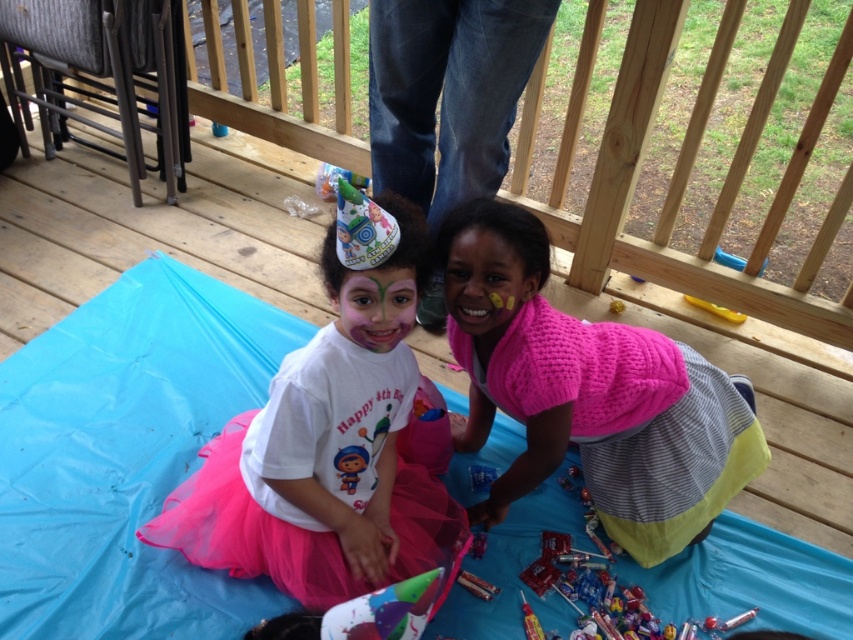
Identify the location of metallic silver toy at lower center. The image size is (853, 640). (476, 586).

Can you confirm if metallic silver toy at lower center is positioned above blue plastic toy at lower center?

No, metallic silver toy at lower center is not above blue plastic toy at lower center.

The height and width of the screenshot is (640, 853). I want to click on metallic silver toy at lower center, so click(x=476, y=586).

Where is `metallic silver toy at lower center`? metallic silver toy at lower center is located at coordinates tap(476, 586).

Does rubberized plastic toy at lower center have a larger size compared to yellow rubber ball at center?

No.

Does rubberized plastic toy at lower center appear under yellow rubber ball at center?

Yes, rubberized plastic toy at lower center is below yellow rubber ball at center.

Which is in front, point (473, 556) or point (614, 310)?

Point (473, 556)

Where is `rubberized plastic toy at lower center`? Image resolution: width=853 pixels, height=640 pixels. rubberized plastic toy at lower center is located at coordinates (479, 545).

Is white matte t-shirt at center bigger than blue plastic toy at upper right?

Indeed, white matte t-shirt at center has a larger size compared to blue plastic toy at upper right.

Which is in front, point (399, 481) or point (715, 252)?

Point (399, 481)

You are a GUI agent. You are given a task and a screenshot of the screen. Output one action in this format:
    pyautogui.click(x=<x>, y=<y>)
    Task: Click on the white matte t-shirt at center
    
    Given the screenshot: What is the action you would take?
    pyautogui.click(x=328, y=452)